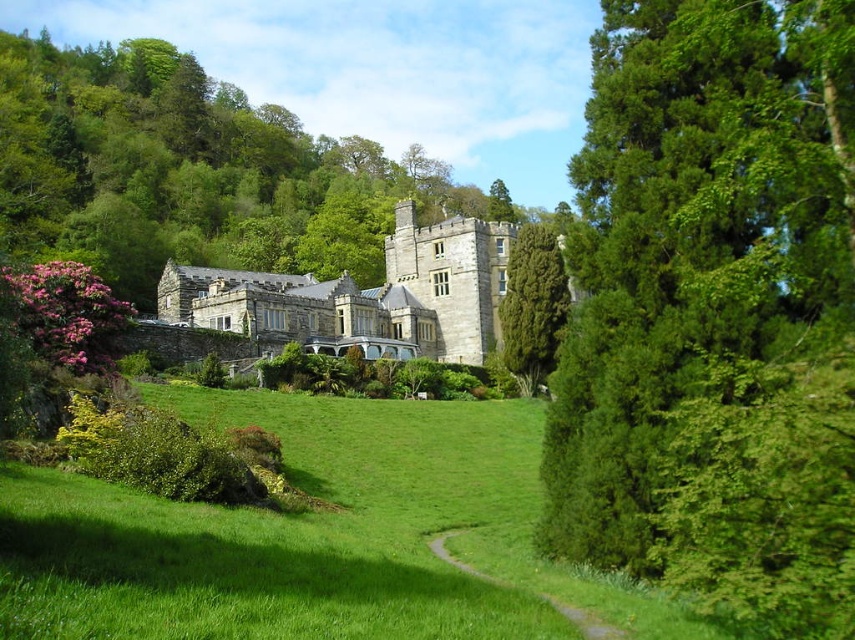
You are a gardener who needs to mow the lawn. You see the green grassy at center and the green leafy tree at center. Which one should you mow?

The green grassy at center should be mowed since it is shorter than the green leafy tree at center, indicating it is the grass that requires trimming.

You are standing at the entrance of the castle and want to take a photo of the green leafy tree at right and the green grassy at center. Which object will appear larger in the photo?

The green leafy tree at right will appear larger in the photo because it is much taller than the green grassy at center.